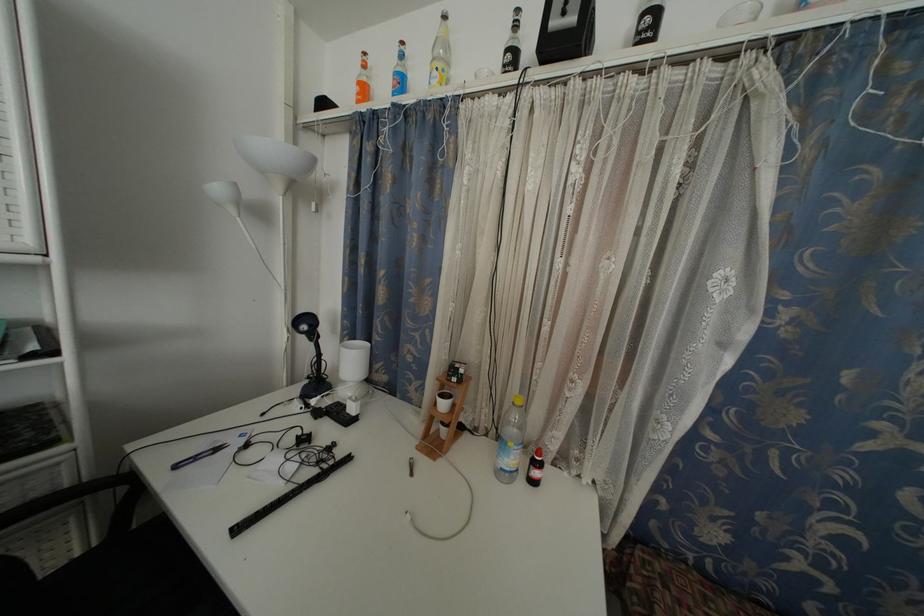
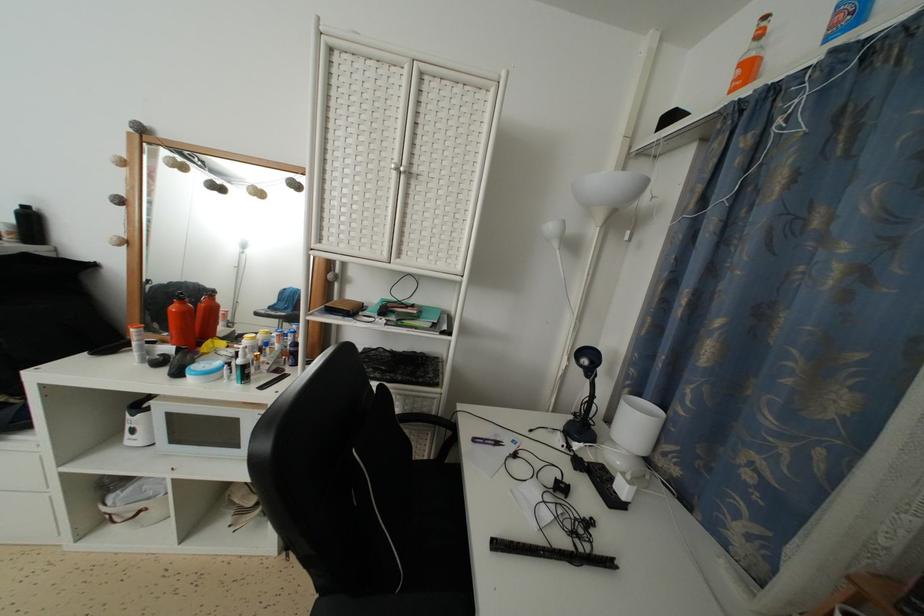
In the second image, find the point that corresponds to the point at 350,344 in the first image.

(630, 395)